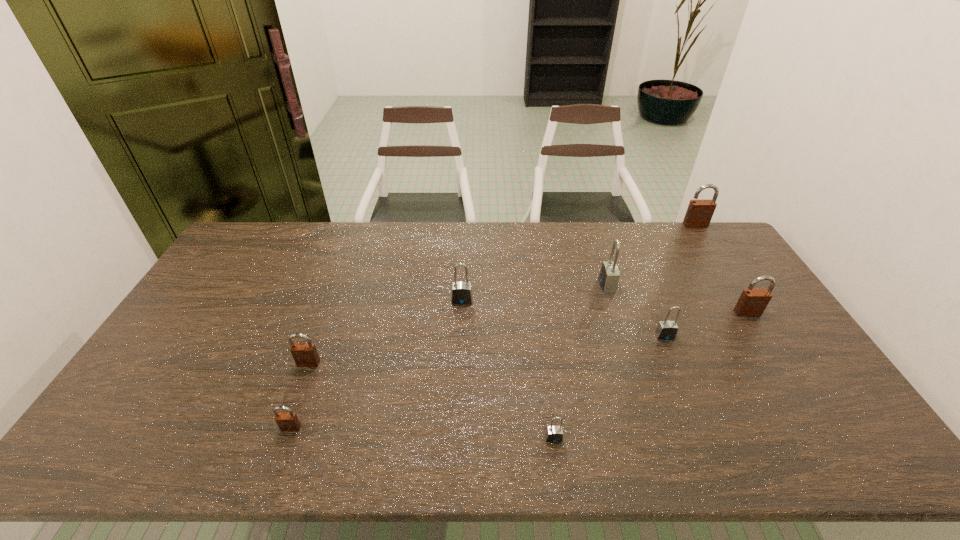
This screenshot has height=540, width=960. I want to click on the third farthest brown padlock, so click(x=304, y=354).

The image size is (960, 540). Identify the location of the third nearest padlock. click(304, 354).

The height and width of the screenshot is (540, 960). I want to click on the smallest gray padlock, so click(x=554, y=434).

Locate an element on the screen. The height and width of the screenshot is (540, 960). the fifth padlock from right to left is located at coordinates (554, 434).

The height and width of the screenshot is (540, 960). Identify the location of the smallest brown padlock. (288, 421).

Find the location of a particular element. Image resolution: width=960 pixels, height=540 pixels. the seventh farthest padlock is located at coordinates (288, 421).

Where is `vacant region located 0.170m on the front-facing side of the farthest brown padlock`? The width and height of the screenshot is (960, 540). vacant region located 0.170m on the front-facing side of the farthest brown padlock is located at coordinates (714, 255).

This screenshot has width=960, height=540. Identify the location of free region located on the shackle of the biggest gray padlock. (551, 285).

The image size is (960, 540). Find the location of `free space located on the shackle of the biggest gray padlock`. free space located on the shackle of the biggest gray padlock is located at coordinates (554, 285).

Find the location of `vacant space located 0.210m on the shackle of the biggest gray padlock`. vacant space located 0.210m on the shackle of the biggest gray padlock is located at coordinates (536, 285).